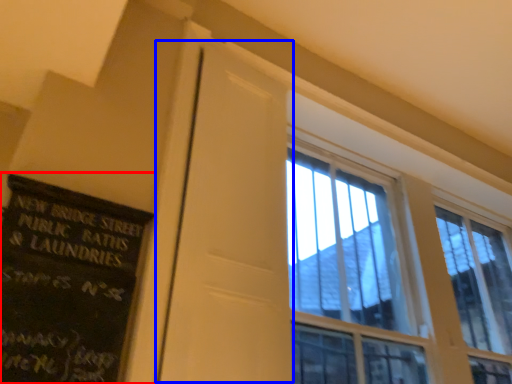
Question: Which of the following is the farthest to the observer, bulletin board (highlighted by a red box) or screen door (highlighted by a blue box)?

Choices:
 (A) bulletin board
 (B) screen door

Answer: (B)